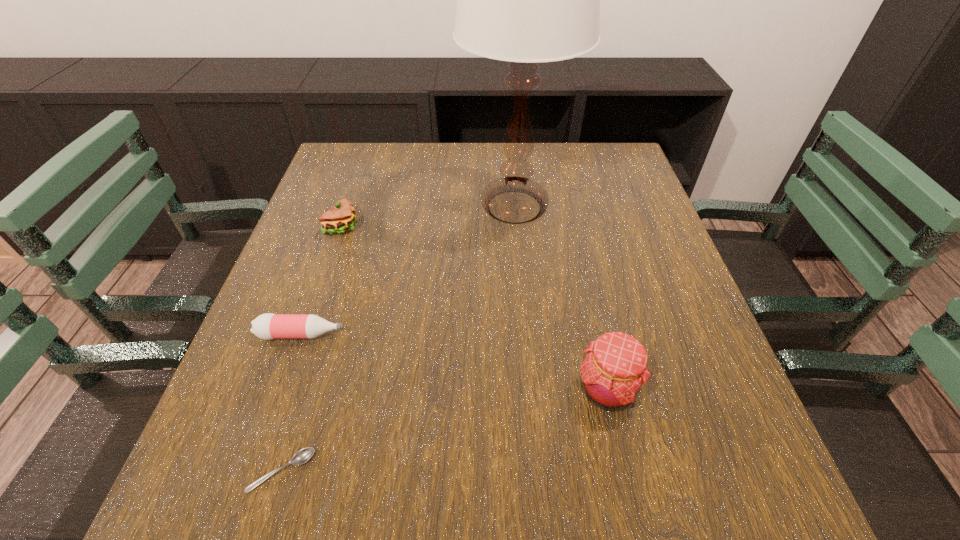
I want to click on empty space between the nearest object and the fourth farthest object, so click(x=444, y=430).

You are a GUI agent. You are given a task and a screenshot of the screen. Output one action in this format:
    pyautogui.click(x=<x>, y=<y>)
    Task: Click on the empty space that is in between the bottle and the nearest object
    The width and height of the screenshot is (960, 540).
    Given the screenshot: What is the action you would take?
    pyautogui.click(x=292, y=403)

At what (x,y) coordinates should I click in order to perform the action: click on vacant space in between the second shortest object and the second tallest object. Please return your answer as a coordinate pair (x, y). The width and height of the screenshot is (960, 540). Looking at the image, I should click on (454, 362).

Find the location of `free space between the third farthest object and the second nearest object`. free space between the third farthest object and the second nearest object is located at coordinates (454, 362).

This screenshot has height=540, width=960. What are the coordinates of `object that is the fourth closest to the jam` in the screenshot? It's located at (339, 219).

Identify which object is the third closest to the bottle. Please provide its 2D coordinates. Your answer should be formatted as a tuple, i.e. [(x, y)], where the tuple contains the x and y coordinates of a point satisfying the conditions above.

[(526, 0)]

Where is `free point that satisfies the following two spatial constraints: 1. on the front-facing side of the table lamp; 2. on the right side of the jam`? free point that satisfies the following two spatial constraints: 1. on the front-facing side of the table lamp; 2. on the right side of the jam is located at coordinates (531, 390).

Locate an element on the screen. vacant space that satisfies the following two spatial constraints: 1. with the cap open on the bottle; 2. on the left side of the jam is located at coordinates (283, 390).

At what (x,y) coordinates should I click in order to perform the action: click on blank area in the image that satisfies the following two spatial constraints: 1. on the front side of the sandwich; 2. with the cap open on the fourth tallest object. Please return your answer as a coordinate pair (x, y). Looking at the image, I should click on (307, 334).

What are the coordinates of `free location that satisfies the following two spatial constraints: 1. on the front-facing side of the tallest object; 2. with the cap open on the third farthest object` in the screenshot? It's located at (526, 334).